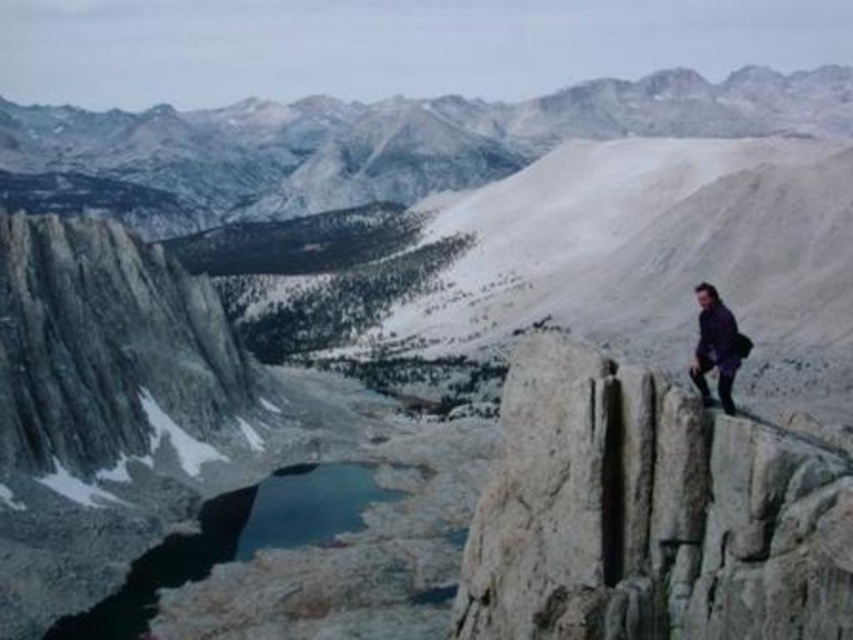
You are planning a hiking route and need to cross from the white rough rock at right to the blue glassy lake at lower left. Based on the scene, what direction should you head to reach the lake from the rock?

You should head downward from the white rough rock at right to reach the blue glassy lake at lower left, as the rock is positioned above the lake.

You are a hiker planning to climb the mountain. You see the white rough rock at right and the purple matte jacket at right. Which object is taller?

The white rough rock at right is taller than the purple matte jacket at right.